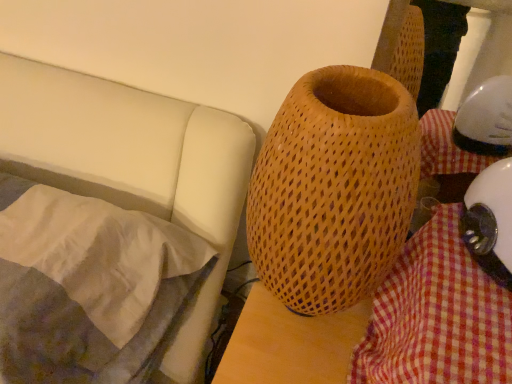
Locate an element on the screen. This screenshot has width=512, height=384. vacant area situated to the left side of white glossy helmet at lower right is located at coordinates (438, 268).